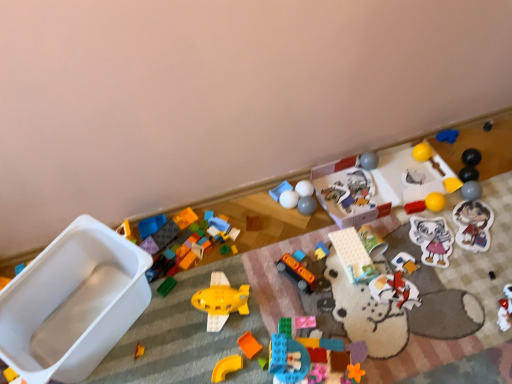
What are the coordinates of `free space that is in between matte gray ball at right, the 2th toy from the right, and translucent plastic blocks at center, arranged as the 11th toy when viewed from the left` in the screenshot? It's located at (395, 281).